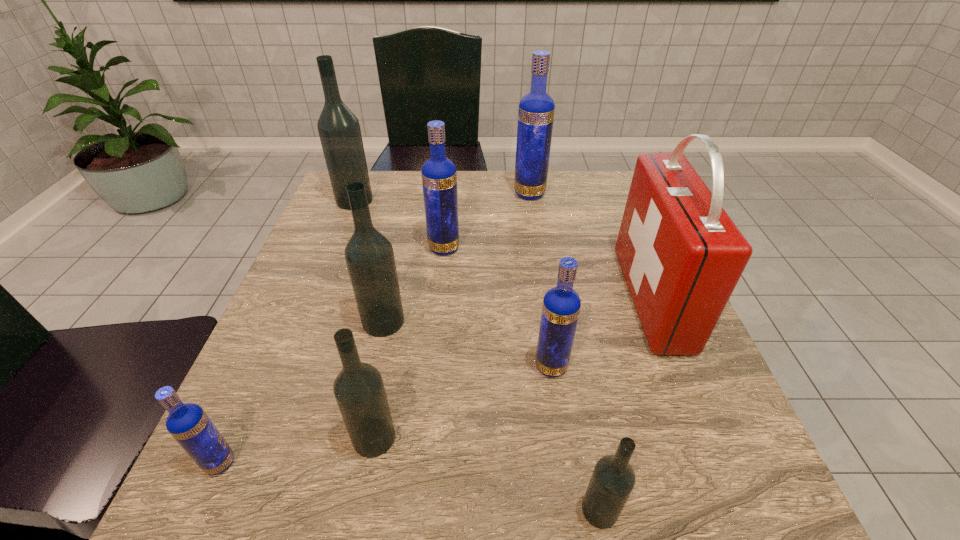
At what (x,y) coordinates should I click in order to perform the action: click on the farthest blue vodka. Please return your answer as a coordinate pair (x, y). Looking at the image, I should click on (536, 110).

The height and width of the screenshot is (540, 960). I want to click on the leftmost black vodka, so click(x=339, y=130).

What are the coordinates of `the farthest black vodka` in the screenshot? It's located at (339, 130).

Locate an element on the screen. red first-aid kit is located at coordinates (681, 255).

This screenshot has width=960, height=540. Identify the location of the first-aid kit. (681, 255).

Identify the location of the second biggest blue vodka. This screenshot has height=540, width=960. (439, 177).

This screenshot has height=540, width=960. In order to click on the third nearest blue vodka in this screenshot , I will do `click(439, 177)`.

Identify the location of the third nearest black vodka. (369, 255).

Identify the location of the third smallest black vodka. (369, 255).

Identify the location of the second nearest blue vodka. This screenshot has height=540, width=960. (561, 305).